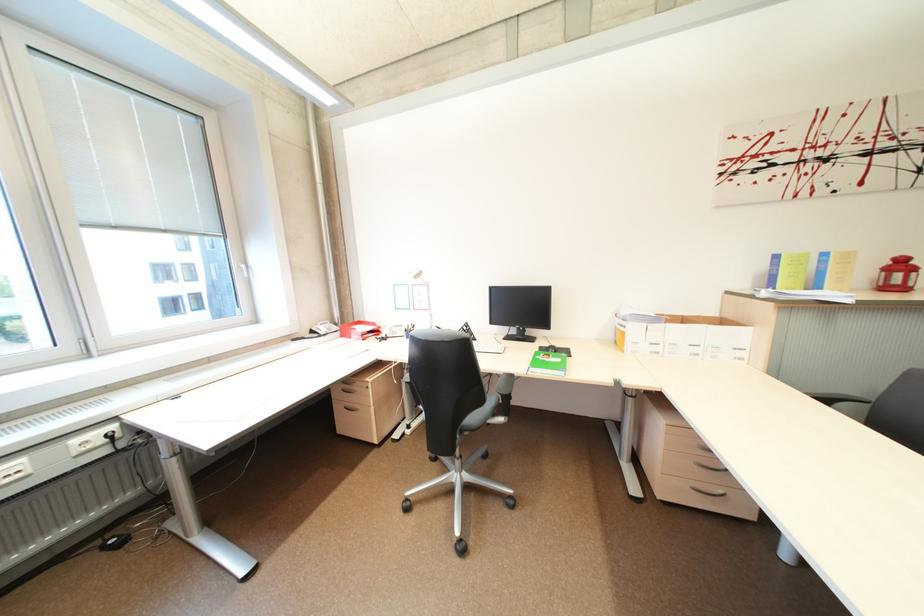
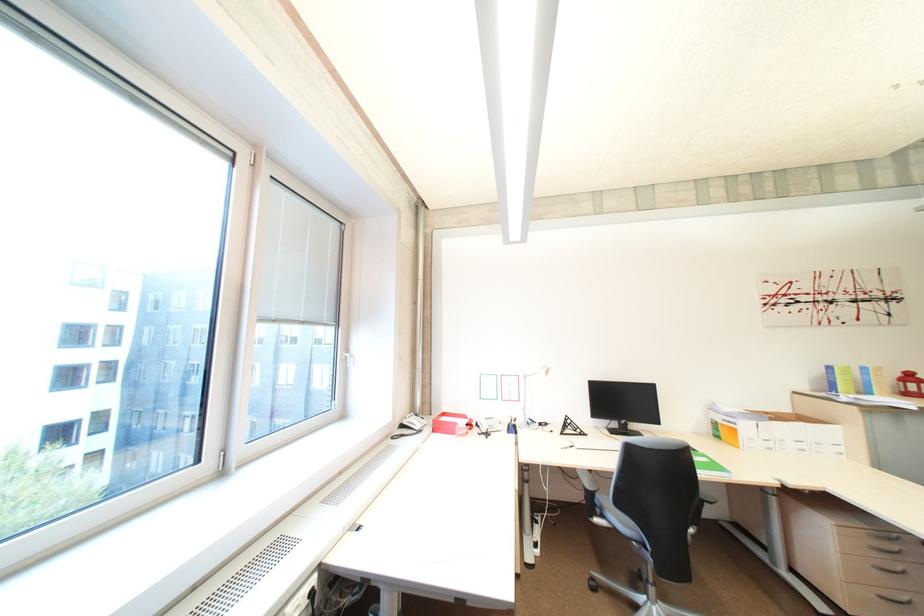
Locate, in the second image, the point that corresponds to (x=572, y=368) in the first image.

(725, 468)